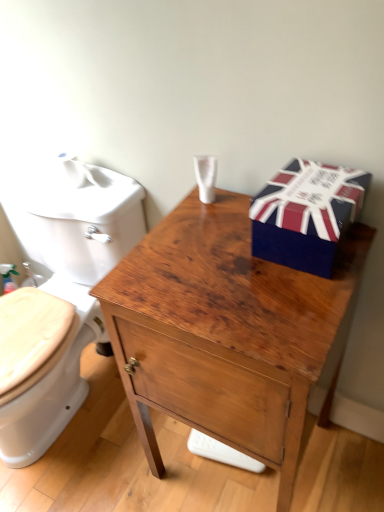
Question: Based on their sizes in the image, would you say white glossy toilet at left is bigger or smaller than wooden cabinet at center?

Choices:
 (A) small
 (B) big

Answer: (B)

Question: Considering the positions of point (54, 413) and point (125, 369), is point (54, 413) closer or farther from the camera than point (125, 369)?

Choices:
 (A) farther
 (B) closer

Answer: (A)

Question: Which is farther from the union jack-patterned cardboard box at upper right?

Choices:
 (A) wooden cabinet at center
 (B) white glossy toilet at left

Answer: (B)

Question: Which is nearer to the union jack-patterned cardboard box at upper right?

Choices:
 (A) white glossy toilet at left
 (B) wooden cabinet at center

Answer: (B)